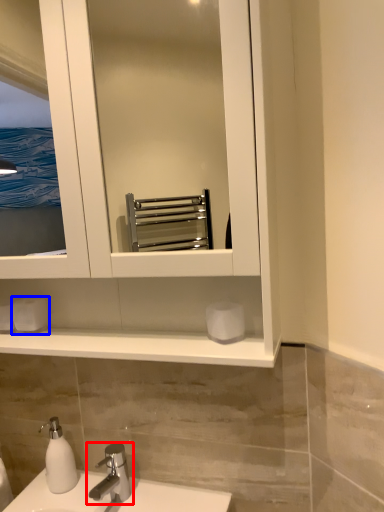
Question: Which object appears closest to the camera in this image, tap (highlighted by a red box) or toilet paper (highlighted by a blue box)?

Choices:
 (A) tap
 (B) toilet paper

Answer: (A)